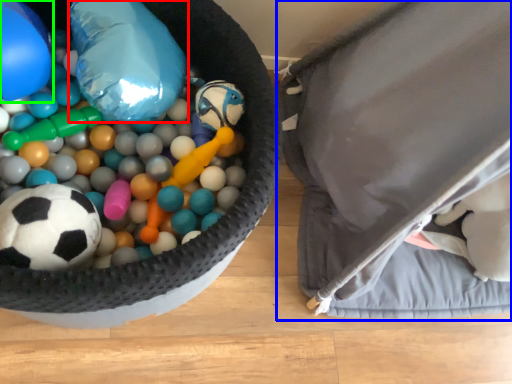
Question: Based on their relative distances, which object is farther from balloon (highlighted by a red box)? Choose from bean bag chair (highlighted by a blue box) and balloon (highlighted by a green box).

Choices:
 (A) bean bag chair
 (B) balloon

Answer: (A)